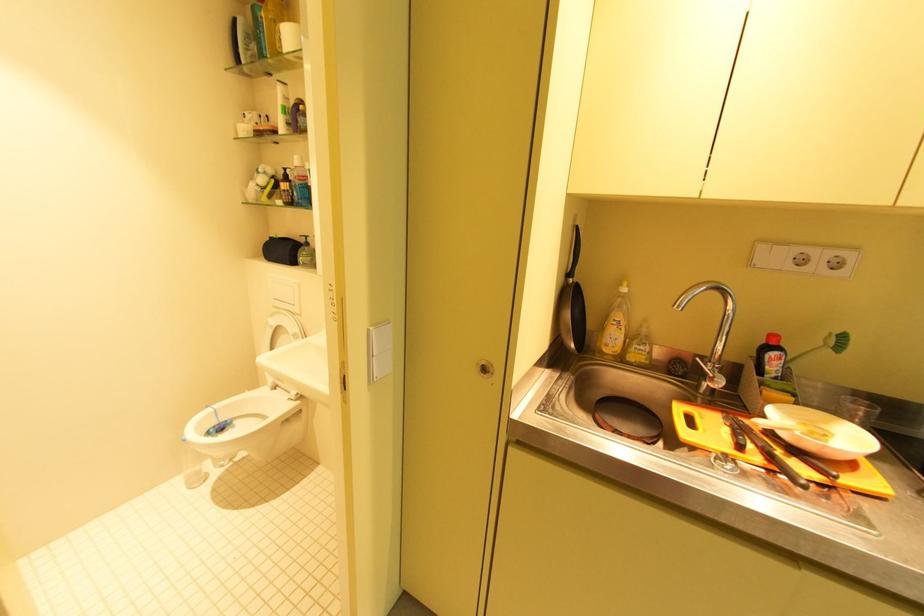
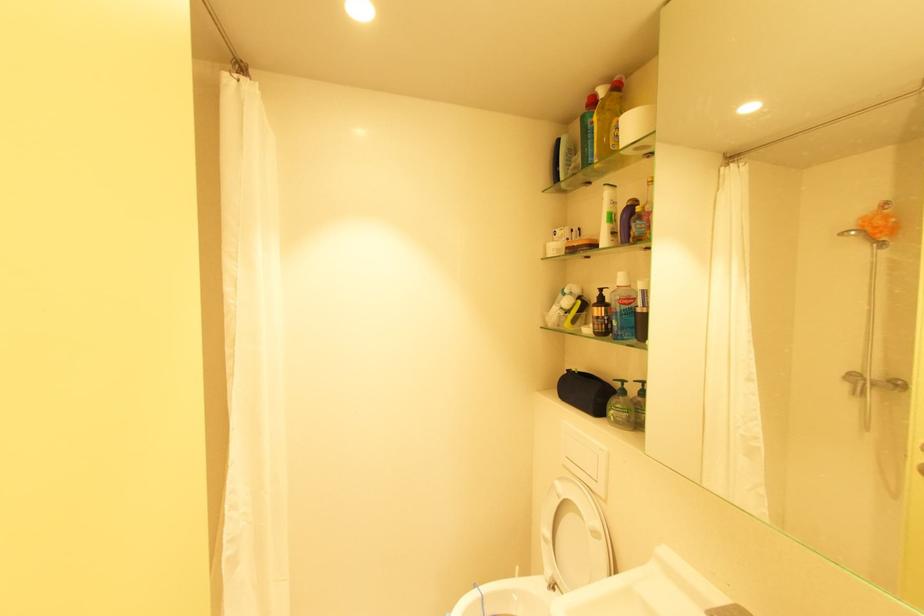
The point at (290,169) is marked in the first image. Where is the corresponding point in the second image?

(606, 291)